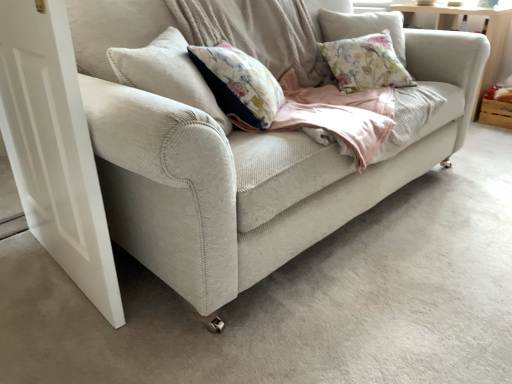
Find the location of `free spot in front of white matte door at left`. free spot in front of white matte door at left is located at coordinates (66, 321).